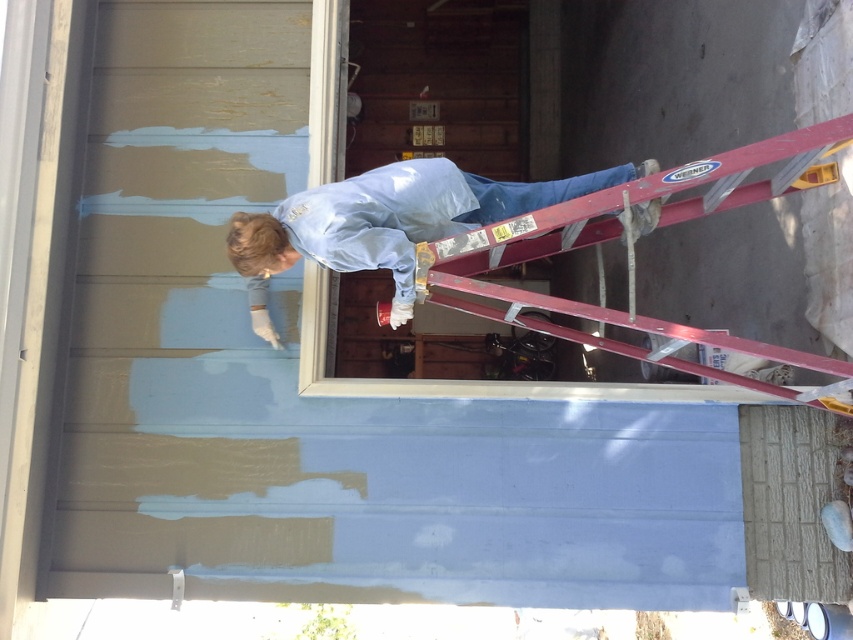
Question: Which point appears farthest from the camera in this image?

Choices:
 (A) (483, 310)
 (B) (392, 314)

Answer: (A)

Question: Which object appears farthest from the camera in this image?

Choices:
 (A) metallic red ladder at upper right
 (B) light blue fabric at upper center

Answer: (B)

Question: Is metallic red ladder at upper right to the right of light blue fabric at upper center from the viewer's perspective?

Choices:
 (A) yes
 (B) no

Answer: (A)

Question: Does metallic red ladder at upper right lie in front of light blue fabric at upper center?

Choices:
 (A) yes
 (B) no

Answer: (A)

Question: Which of the following is the closest to the observer?

Choices:
 (A) (699, 173)
 (B) (415, 212)

Answer: (A)

Question: Can you confirm if metallic red ladder at upper right is positioned to the left of light blue fabric at upper center?

Choices:
 (A) yes
 (B) no

Answer: (B)